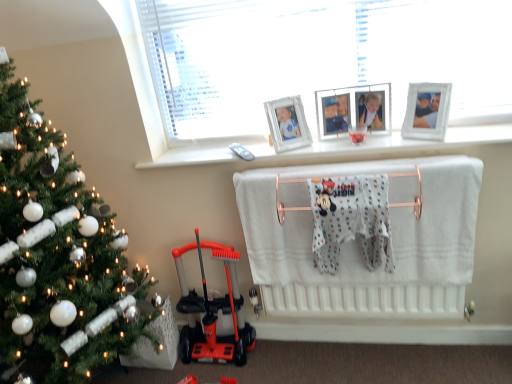
What do you see at coordinates (213, 311) in the screenshot? I see `orange plastic scooter at lower left` at bounding box center [213, 311].

Where is `orange plastic scooter at lower left`? orange plastic scooter at lower left is located at coordinates (213, 311).

The width and height of the screenshot is (512, 384). In order to click on white glass window at upper center in this screenshot , I will do `click(151, 92)`.

This screenshot has width=512, height=384. Identify the location of white wooden picture frame at upper center, the first picture frame from the left. (353, 110).

Is orange plastic scooter at lower left located within white glossy picture frame at upper right, which appears as the first picture frame when viewed from the right?

No, orange plastic scooter at lower left is not surrounded by white glossy picture frame at upper right, which appears as the first picture frame when viewed from the right.

Between white glossy picture frame at upper right, which appears as the first picture frame when viewed from the right, and orange plastic scooter at lower left, which one appears on the left side from the viewer's perspective?

orange plastic scooter at lower left is more to the left.

What's the angular difference between white glossy picture frame at upper right, which ranks as the 2th picture frame in left-to-right order, and orange plastic scooter at lower left's facing directions?

31 degrees separate the facing orientations of white glossy picture frame at upper right, which ranks as the 2th picture frame in left-to-right order, and orange plastic scooter at lower left.

Which object is further away from the camera, white glossy picture frame at upper right, which ranks as the 2th picture frame in left-to-right order, or orange plastic scooter at lower left?

Positioned behind is orange plastic scooter at lower left.

Is orange plastic scooter at lower left turned away from white fabric infant bed at center?

No.

Which object is positioned more to the left, orange plastic scooter at lower left or white fabric infant bed at center?

From the viewer's perspective, orange plastic scooter at lower left appears more on the left side.

Is orange plastic scooter at lower left positioned beyond the bounds of white fabric infant bed at center?

That's correct, orange plastic scooter at lower left is outside of white fabric infant bed at center.

How much distance is there between orange plastic scooter at lower left and white fabric infant bed at center?

They are 19.08 inches apart.

Would you say green matte christmas tree at left is to the left or to the right of white cotton bath towel at center in the picture?

green matte christmas tree at left is to the left of white cotton bath towel at center.

Is point (48, 231) closer to viewer compared to point (358, 203)?

Yes.

Based on the photo, from a real-world perspective, which object stands above the other?

green matte christmas tree at left.

Find the location of `bath towel on the right side of green matte christmas tree at left`. bath towel on the right side of green matte christmas tree at left is located at coordinates (351, 220).

Between orange plastic scooter at lower left and white glossy picture frame at upper right, which ranks as the 2th picture frame in left-to-right order, which one has larger width?

Wider between the two is orange plastic scooter at lower left.

Does point (234, 339) come behind point (416, 98)?

Yes, point (234, 339) is farther from viewer.

Are orange plastic scooter at lower left and white glossy picture frame at upper right, which appears as the first picture frame when viewed from the right, making contact?

No, orange plastic scooter at lower left is not with white glossy picture frame at upper right, which appears as the first picture frame when viewed from the right.

Find the location of a particular element. The width and height of the screenshot is (512, 384). the 2nd picture frame in front of the orange plastic scooter at lower left is located at coordinates (426, 111).

The height and width of the screenshot is (384, 512). What are the coordinates of `picture frame lying in front of the white fabric infant bed at center` in the screenshot? It's located at (426, 111).

In terms of size, does white glossy picture frame at upper right, which ranks as the 2th picture frame in left-to-right order, appear bigger or smaller than white fabric infant bed at center?

In the image, white glossy picture frame at upper right, which ranks as the 2th picture frame in left-to-right order, appears to be smaller than white fabric infant bed at center.

How different are the orientations of white glossy picture frame at upper right, which ranks as the 2th picture frame in left-to-right order, and white fabric infant bed at center in degrees?

They differ by 29.7 degrees in their facing directions.

Which of these two, white cotton bath towel at center or green matte christmas tree at left, is smaller?

With smaller size is white cotton bath towel at center.

In the image, is white cotton bath towel at center on the left side or the right side of green matte christmas tree at left?

From the image, it's evident that white cotton bath towel at center is to the right of green matte christmas tree at left.

From a real-world perspective, does white cotton bath towel at center sit lower than green matte christmas tree at left?

Correct, in the physical world, white cotton bath towel at center is lower than green matte christmas tree at left.

Measure the distance from white cotton bath towel at center to green matte christmas tree at left.

white cotton bath towel at center is 36.23 inches from green matte christmas tree at left.

Are white wooden picture frame at upper center, the first picture frame from the left, and white glass window at upper center beside each other?

No, white wooden picture frame at upper center, the first picture frame from the left, is not beside white glass window at upper center.

Is white wooden picture frame at upper center, the first picture frame from the left, inside the boundaries of white glass window at upper center, or outside?

white wooden picture frame at upper center, the first picture frame from the left, fits inside white glass window at upper center.

Which is behind, point (351, 103) or point (198, 155)?

The point (198, 155) is farther.

Is white wooden picture frame at upper center, the first picture frame from the left, positioned behind white glass window at upper center?

That is True.

The height and width of the screenshot is (384, 512). Identify the location of the 2nd picture frame to the right of the orange plastic scooter at lower left, starting your count from the anchor. (426, 111).

The image size is (512, 384). In order to click on infant bed above the orange plastic scooter at lower left (from the image's perspective) in this screenshot , I will do `click(360, 246)`.

Estimate the real-world distances between objects in this image. Which object is closer to white cotton bath towel at center, white glass window at upper center or white wooden picture frame at upper center, the first picture frame from the left?

white wooden picture frame at upper center, the first picture frame from the left, is positioned closer to the anchor white cotton bath towel at center.

Considering their positions, is white cotton bath towel at center positioned further to green matte christmas tree at left than white wooden picture frame at upper center, which is counted as the 2th picture frame, starting from the right?

white wooden picture frame at upper center, which is counted as the 2th picture frame, starting from the right, lies further to green matte christmas tree at left than the other object.

Considering their positions, is white glass window at upper center positioned further to white wooden picture frame at upper center, the first picture frame from the left, than white glossy picture frame at upper right, which ranks as the 2th picture frame in left-to-right order?

white glass window at upper center is further to white wooden picture frame at upper center, the first picture frame from the left.

Based on their spatial positions, is green matte christmas tree at left or white wooden picture frame at upper center, the first picture frame from the left, further from orange plastic scooter at lower left?

white wooden picture frame at upper center, the first picture frame from the left, is positioned further to the anchor orange plastic scooter at lower left.

Looking at the image, which one is located further to white fabric infant bed at center, white cotton bath towel at center or white wooden picture frame at upper center, which is counted as the 2th picture frame, starting from the right?

white wooden picture frame at upper center, which is counted as the 2th picture frame, starting from the right.

Based on their spatial positions, is white cotton bath towel at center or white glass window at upper center further from white glossy picture frame at upper right, which ranks as the 2th picture frame in left-to-right order?

white glass window at upper center.

In the scene shown: Looking at the image, which one is located further to white cotton bath towel at center, white fabric infant bed at center or green matte christmas tree at left?

green matte christmas tree at left lies further to white cotton bath towel at center than the other object.

Considering their positions, is white wooden picture frame at upper center, which is counted as the 2th picture frame, starting from the right, positioned further to white cotton bath towel at center than white fabric infant bed at center?

The object further to white cotton bath towel at center is white wooden picture frame at upper center, which is counted as the 2th picture frame, starting from the right.

Locate an element on the screen. window between green matte christmas tree at left and white glossy picture frame at upper right, which appears as the first picture frame when viewed from the right, in the horizontal direction is located at coordinates (151, 92).

Identify the location of bath towel between orange plastic scooter at lower left and white fabric infant bed at center from left to right. This screenshot has height=384, width=512. (351, 220).

Find the location of a particular element. toy between green matte christmas tree at left and white fabric infant bed at center from left to right is located at coordinates (213, 311).

Where is `picture frame between white wooden picture frame at upper center, which is counted as the 2th picture frame, starting from the right, and white cotton bath towel at center vertically`? This screenshot has height=384, width=512. picture frame between white wooden picture frame at upper center, which is counted as the 2th picture frame, starting from the right, and white cotton bath towel at center vertically is located at coordinates (426, 111).